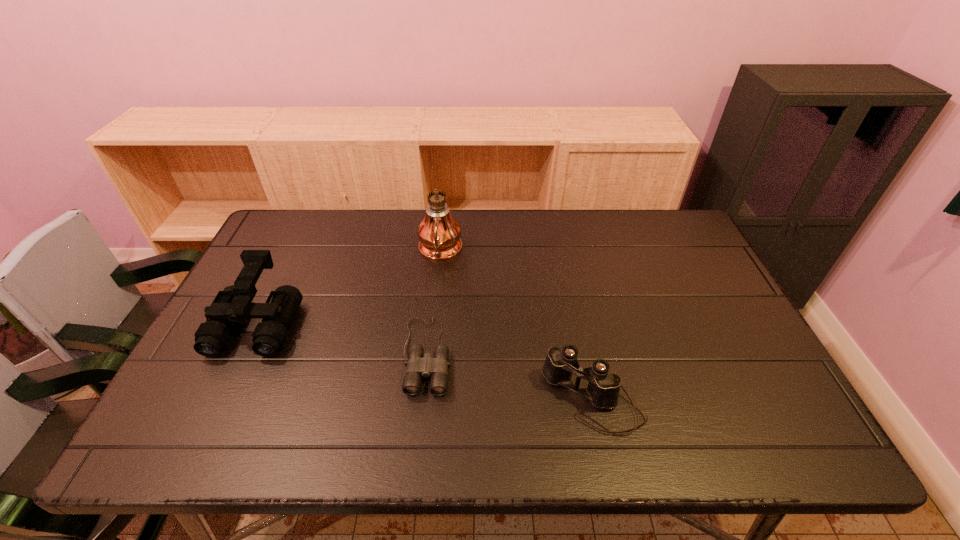
Where is `vacant point located between the tallest object and the shortest binoculars`? The image size is (960, 540). vacant point located between the tallest object and the shortest binoculars is located at coordinates (434, 302).

What are the coordinates of `unoccupied position between the shortest binoculars and the leftmost object` in the screenshot? It's located at (343, 338).

What are the coordinates of `vacant area that lies between the shortest binoculars and the rightmost binoculars` in the screenshot? It's located at click(x=510, y=377).

The image size is (960, 540). I want to click on blank region between the rightmost object and the oil lamp, so click(516, 326).

Locate an element on the screen. vacant space that is in between the second tallest binoculars and the tallest object is located at coordinates (516, 326).

Where is `vacant region between the farthest object and the third shortest object`? The width and height of the screenshot is (960, 540). vacant region between the farthest object and the third shortest object is located at coordinates tap(349, 287).

Locate an element on the screen. This screenshot has height=540, width=960. free point between the second binoculars from left to right and the second shortest object is located at coordinates (510, 377).

This screenshot has width=960, height=540. Find the location of `empty location between the oil lamp and the second shortest binoculars`. empty location between the oil lamp and the second shortest binoculars is located at coordinates (516, 326).

Locate an element on the screen. vacant area that lies between the leftmost object and the shortest binoculars is located at coordinates (343, 338).

Identify the location of free spot between the tallest object and the tallest binoculars. (349, 287).